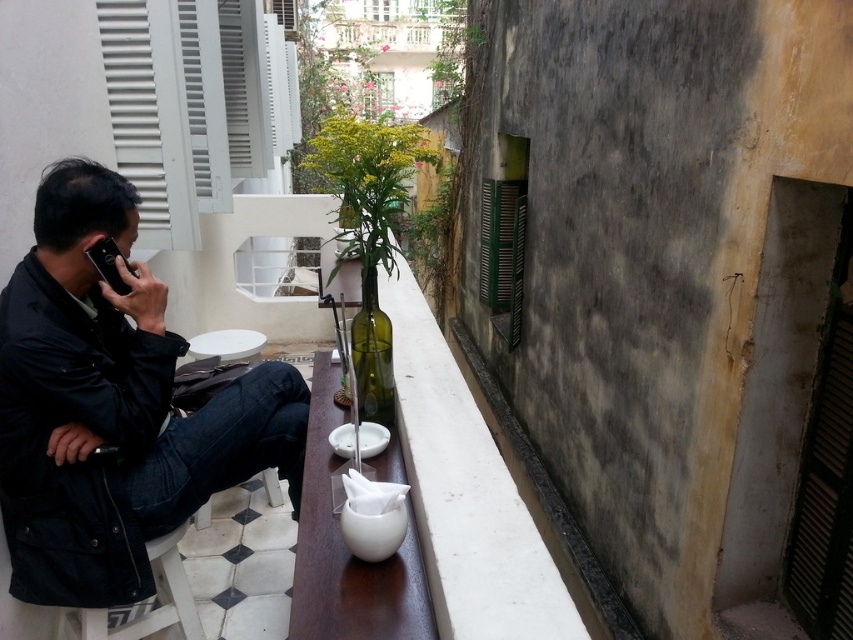
Does black matte jacket at left appear under white plastic stool at lower left?

Actually, black matte jacket at left is above white plastic stool at lower left.

Can you confirm if black matte jacket at left is positioned above white plastic stool at lower left?

Yes.

Is point (45, 216) more distant than point (181, 608)?

No, it is in front of (181, 608).

Where is `black matte jacket at left`? Image resolution: width=853 pixels, height=640 pixels. black matte jacket at left is located at coordinates (112, 406).

Can you confirm if white plastic stool at lower left is smaller than white glossy table at center?

No, white plastic stool at lower left is not smaller than white glossy table at center.

Between white plastic stool at lower left and white glossy table at center, which one is positioned lower?

Positioned lower is white plastic stool at lower left.

Does point (189, 589) come farther from viewer compared to point (218, 339)?

No, (189, 589) is closer to viewer.

I want to click on white plastic stool at lower left, so click(x=148, y=611).

Is black matte jacket at left bigger than white glossy table at center?

Correct, black matte jacket at left is larger in size than white glossy table at center.

Can you confirm if black matte jacket at left is thinner than white glossy table at center?

No, black matte jacket at left is not thinner than white glossy table at center.

Which is in front, point (100, 433) or point (229, 358)?

Positioned in front is point (100, 433).

I want to click on black matte jacket at left, so click(112, 406).